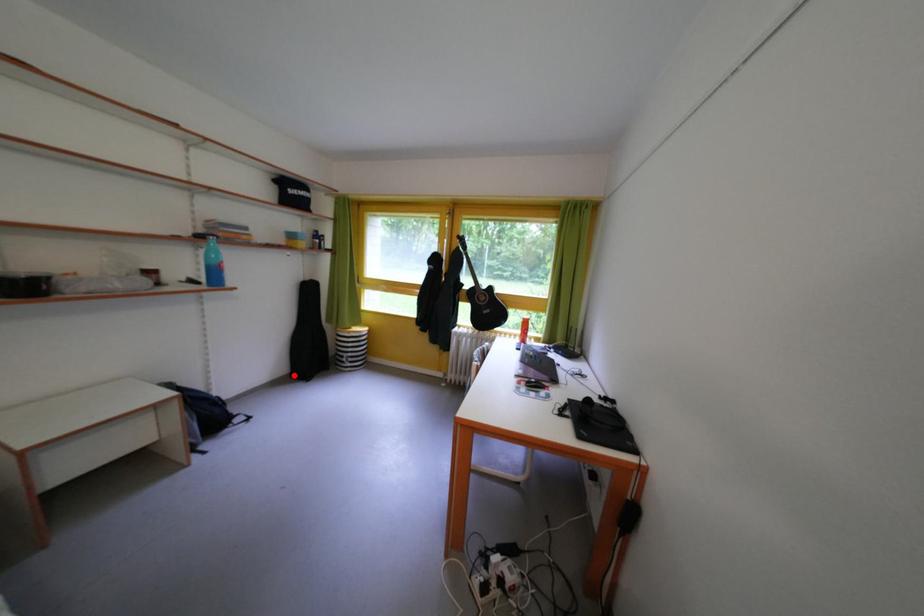
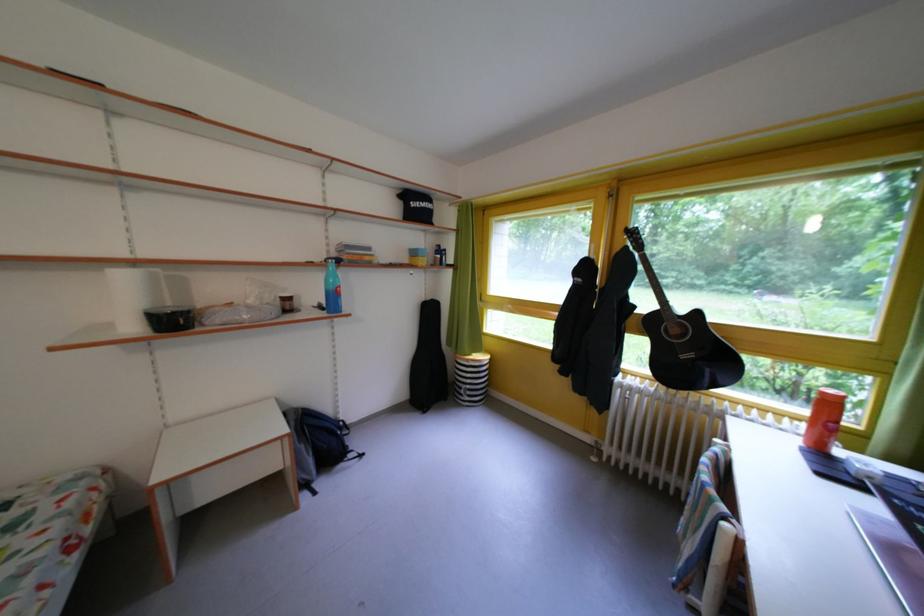
Locate, in the second image, the point that corresponds to the highlighted location in the first image.

(415, 400)